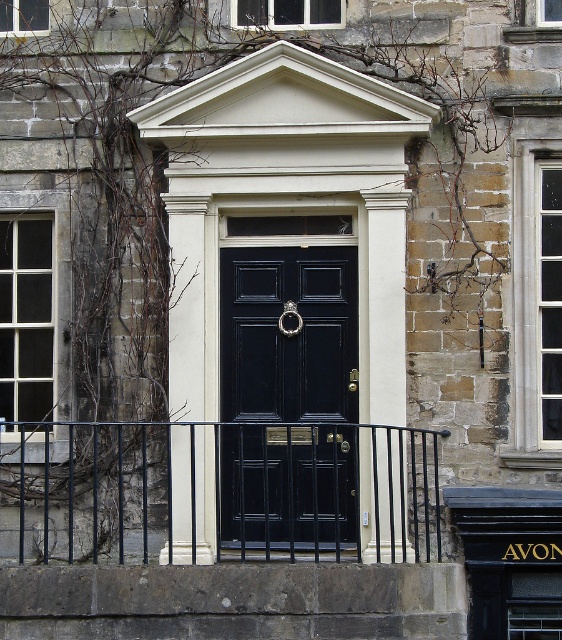
Question: Among these objects, which one is farthest from the camera?

Choices:
 (A) black wrought iron at center
 (B) matte black door at center

Answer: (B)

Question: Does black wrought iron at center appear over matte black door at center?

Choices:
 (A) no
 (B) yes

Answer: (A)

Question: Does black wrought iron at center have a larger size compared to matte black door at center?

Choices:
 (A) yes
 (B) no

Answer: (A)

Question: Which point appears farthest from the camera in this image?

Choices:
 (A) (369, 492)
 (B) (248, 298)

Answer: (B)

Question: Is black wrought iron at center positioned in front of matte black door at center?

Choices:
 (A) yes
 (B) no

Answer: (A)